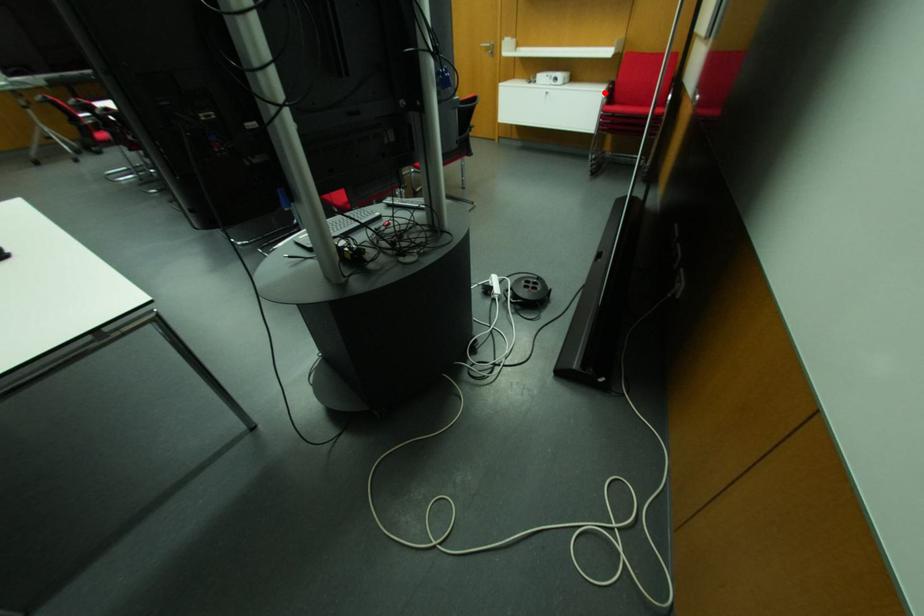
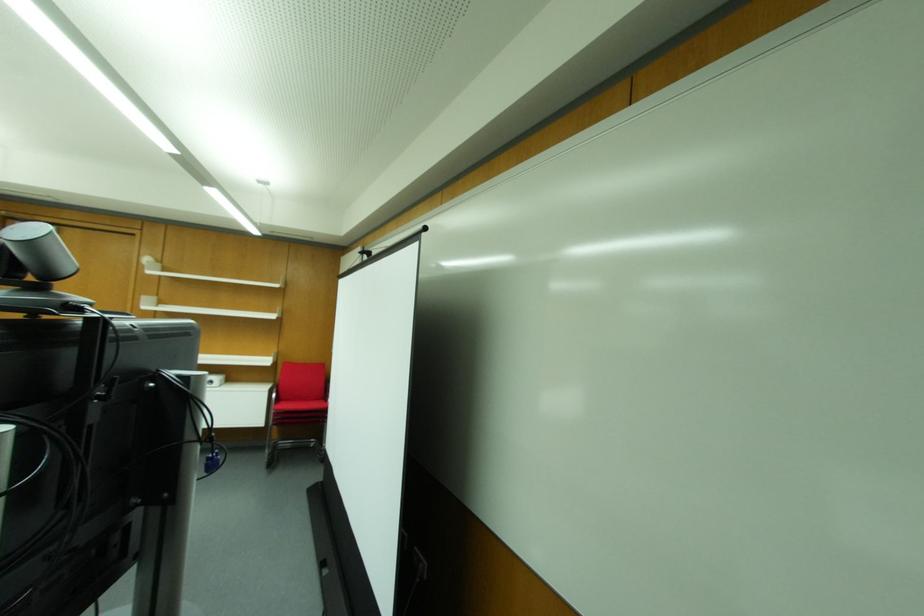
The point at the highlighted location is marked in the first image. Where is the corresponding point in the second image?

(274, 394)